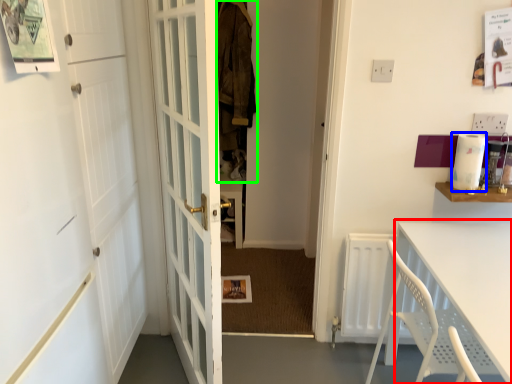
Question: Which is nearer to the table (highlighted by a red box)? appliance (highlighted by a blue box) or laundry (highlighted by a green box).

Choices:
 (A) appliance
 (B) laundry

Answer: (A)